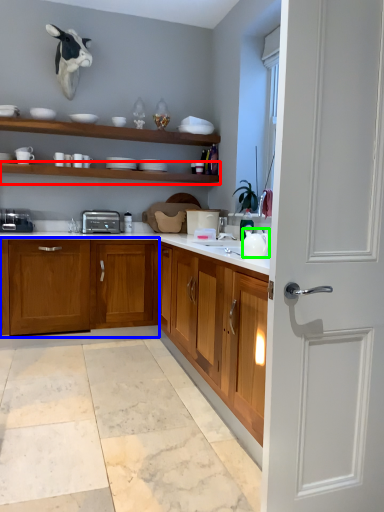
Question: Considering the real-world distances, which object is farthest from shelf (highlighted by a red box)? cabinetry (highlighted by a blue box) or tea pot (highlighted by a green box)?

Choices:
 (A) cabinetry
 (B) tea pot

Answer: (B)